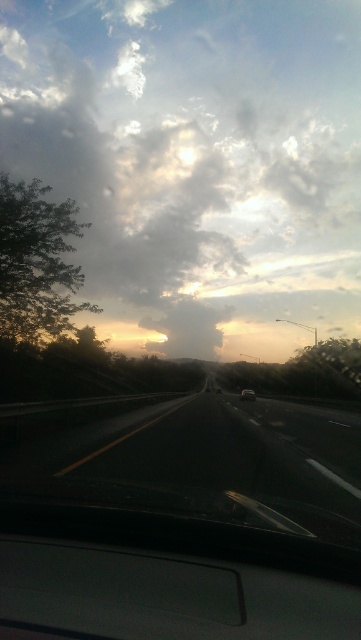
Question: Does cloudy sky at upper center lie behind shiny silver sedan at center?

Choices:
 (A) yes
 (B) no

Answer: (B)

Question: Does cloudy sky at upper center have a smaller size compared to shiny silver sedan at center?

Choices:
 (A) yes
 (B) no

Answer: (B)

Question: Which object is farther from the camera taking this photo?

Choices:
 (A) shiny silver sedan at center
 (B) black asphalt highway at center
 (C) cloudy sky at upper center

Answer: (A)

Question: Where is cloudy sky at upper center located in relation to shiny silver sedan at center in the image?

Choices:
 (A) below
 (B) above

Answer: (B)

Question: Which of the following is the farthest from the observer?

Choices:
 (A) (241, 396)
 (B) (68, 173)
 (C) (301, 516)

Answer: (B)

Question: Estimate the real-world distances between objects in this image. Which object is farther from the cloudy sky at upper center?

Choices:
 (A) black asphalt highway at center
 (B) shiny silver sedan at center

Answer: (A)